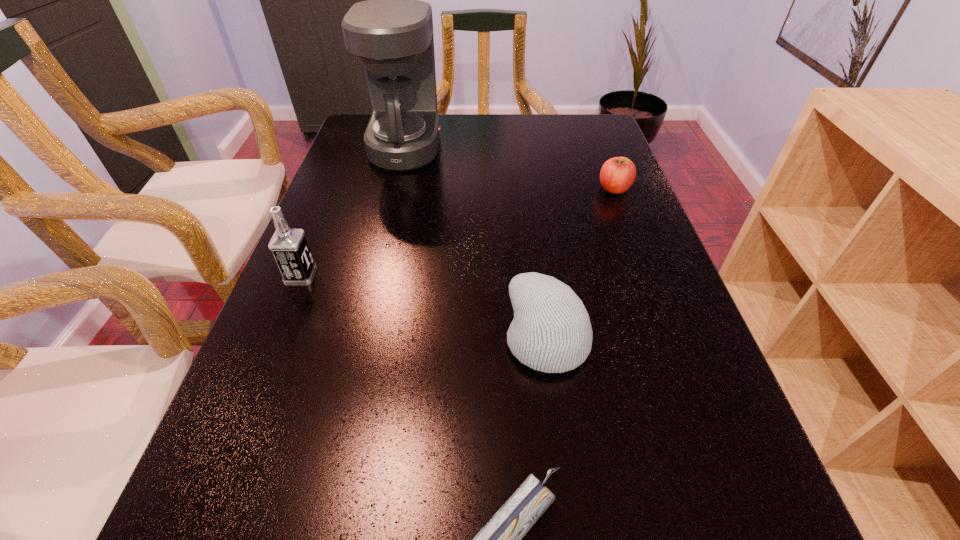
The width and height of the screenshot is (960, 540). I want to click on vacant space that satisfies the following two spatial constraints: 1. on the button side of the beanie; 2. on the left side of the farthest object, so click(x=360, y=335).

Where is `vacant space that satisfies the following two spatial constraints: 1. on the button side of the apple; 2. on the left side of the coffee maker`? This screenshot has width=960, height=540. vacant space that satisfies the following two spatial constraints: 1. on the button side of the apple; 2. on the left side of the coffee maker is located at coordinates (396, 189).

At what (x,y) coordinates should I click in order to perform the action: click on vacant area that satisfies the following two spatial constraints: 1. on the back side of the third tallest object; 2. on the right side of the fourth nearest object. Please return your answer as a coordinate pair (x, y). Image resolution: width=960 pixels, height=540 pixels. Looking at the image, I should click on (527, 189).

I want to click on free region that satisfies the following two spatial constraints: 1. on the front label of the second tallest object; 2. on the right side of the third shortest object, so click(x=276, y=335).